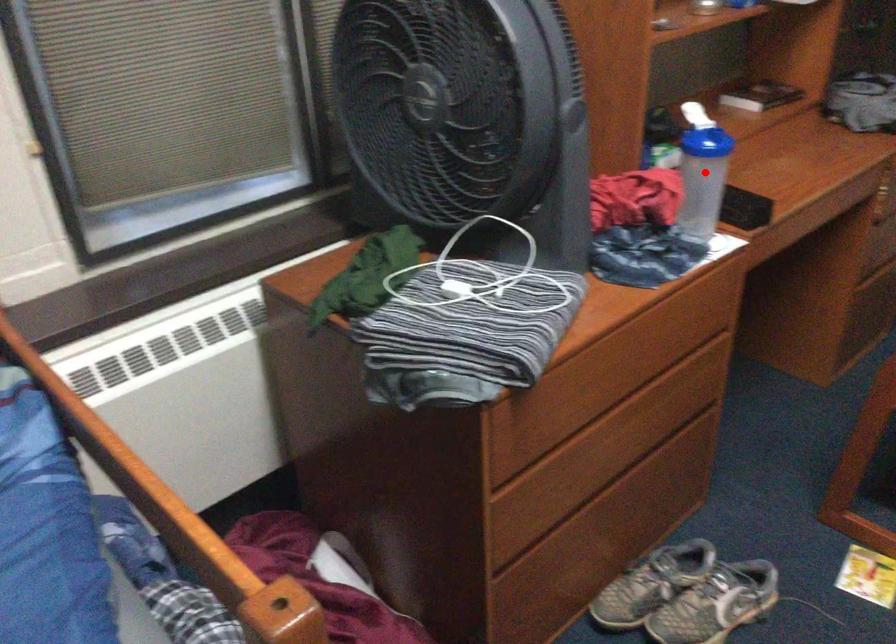
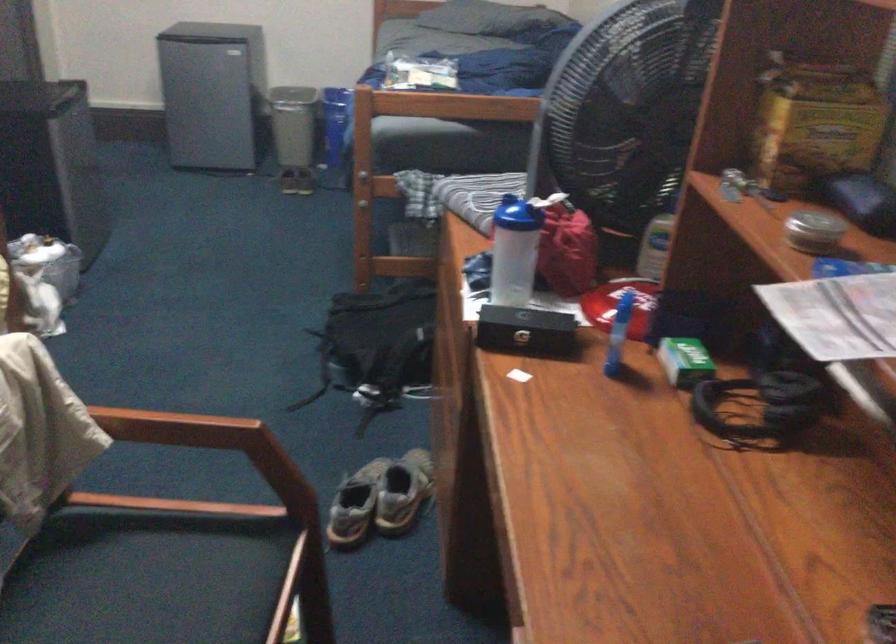
The point at the highlighted location is marked in the first image. Where is the corresponding point in the second image?

(513, 251)